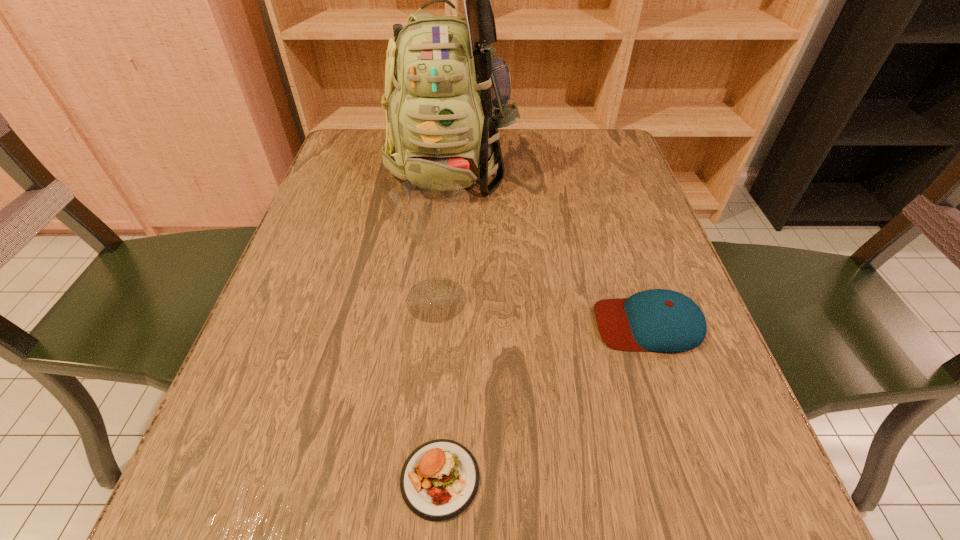
In the image, there is a desktop. Identify the location of vacant space at the left edge. tap(283, 353).

The height and width of the screenshot is (540, 960). I want to click on vacant space at the far left corner of the desktop, so click(373, 139).

In order to click on free space at the far right corner of the desktop in this screenshot , I will do `click(565, 153)`.

You are a GUI agent. You are given a task and a screenshot of the screen. Output one action in this format:
    pyautogui.click(x=<x>, y=<y>)
    Task: Click on the vacant area at the near right corner
    The image size is (960, 540).
    Given the screenshot: What is the action you would take?
    pyautogui.click(x=760, y=491)

What are the coordinates of `vacant point located between the second shortest object and the patty (food)` in the screenshot? It's located at (544, 401).

In order to click on empty space between the nearest object and the baseball cap in this screenshot , I will do `click(544, 401)`.

Where is `empty location between the second tallest object and the rightmost object`? The image size is (960, 540). empty location between the second tallest object and the rightmost object is located at coordinates (542, 312).

Find the location of `empty space between the rightmost object and the shortest object`. empty space between the rightmost object and the shortest object is located at coordinates (544, 401).

I want to click on empty space between the rightmost object and the flute glass, so click(542, 312).

In order to click on vacant space that is in between the patty (food) and the tallest object in this screenshot , I will do `click(446, 321)`.